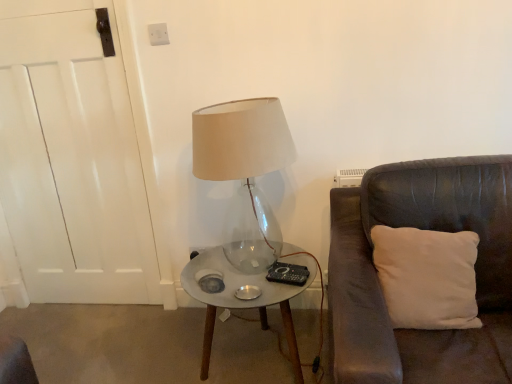
Question: Is clear glass table at center facing towards transparent glass lamp at center?

Choices:
 (A) no
 (B) yes

Answer: (A)

Question: Is clear glass table at center positioned before transparent glass lamp at center?

Choices:
 (A) no
 (B) yes

Answer: (A)

Question: Is clear glass table at center further to the viewer compared to transparent glass lamp at center?

Choices:
 (A) no
 (B) yes

Answer: (B)

Question: From a real-world perspective, is clear glass table at center below transparent glass lamp at center?

Choices:
 (A) no
 (B) yes

Answer: (B)

Question: Considering the relative positions of clear glass table at center and transparent glass lamp at center in the image provided, is clear glass table at center to the right of transparent glass lamp at center from the viewer's perspective?

Choices:
 (A) no
 (B) yes

Answer: (B)

Question: From a real-world perspective, is clear glass table at center physically above transparent glass lamp at center?

Choices:
 (A) yes
 (B) no

Answer: (B)

Question: Considering the relative positions of transparent glass lamp at center and white soft cushion at right in the image provided, is transparent glass lamp at center to the right of white soft cushion at right from the viewer's perspective?

Choices:
 (A) yes
 (B) no

Answer: (B)

Question: Is transparent glass lamp at center positioned far away from white soft cushion at right?

Choices:
 (A) yes
 (B) no

Answer: (B)

Question: Does transparent glass lamp at center have a smaller size compared to white soft cushion at right?

Choices:
 (A) yes
 (B) no

Answer: (B)

Question: Can you confirm if transparent glass lamp at center is wider than white soft cushion at right?

Choices:
 (A) no
 (B) yes

Answer: (B)

Question: Can you confirm if transparent glass lamp at center is taller than white soft cushion at right?

Choices:
 (A) no
 (B) yes

Answer: (B)

Question: From the image's perspective, is transparent glass lamp at center below white soft cushion at right?

Choices:
 (A) no
 (B) yes

Answer: (A)

Question: Is white soft cushion at right smaller than transparent glass lamp at center?

Choices:
 (A) yes
 (B) no

Answer: (A)